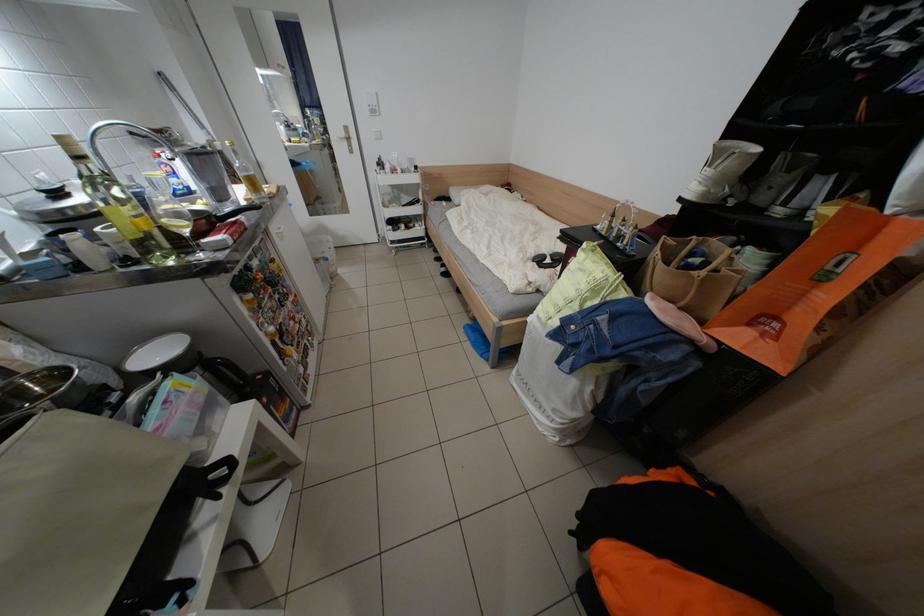
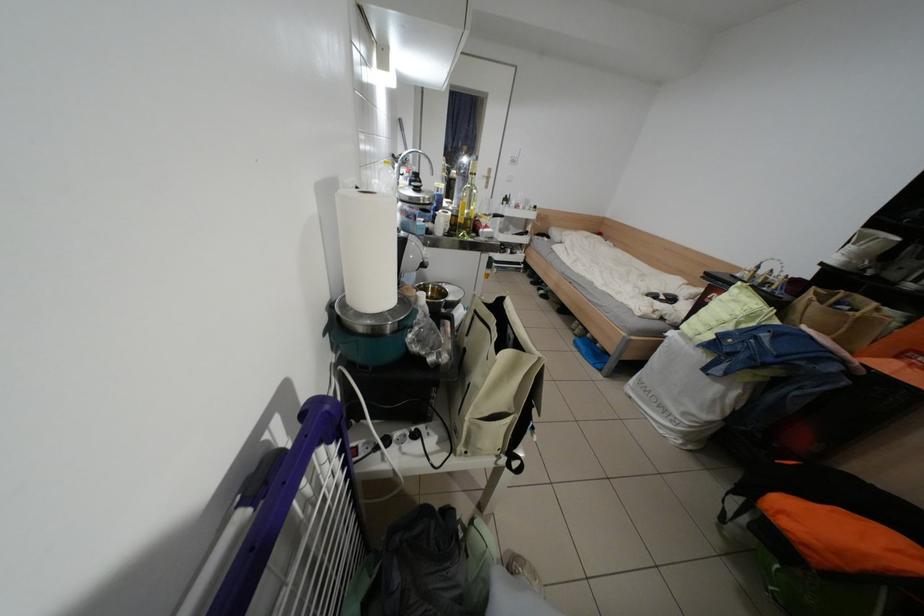
Question: How did the camera likely rotate?

Choices:
 (A) Left
 (B) Right
 (C) Up
 (D) Down

Answer: (C)